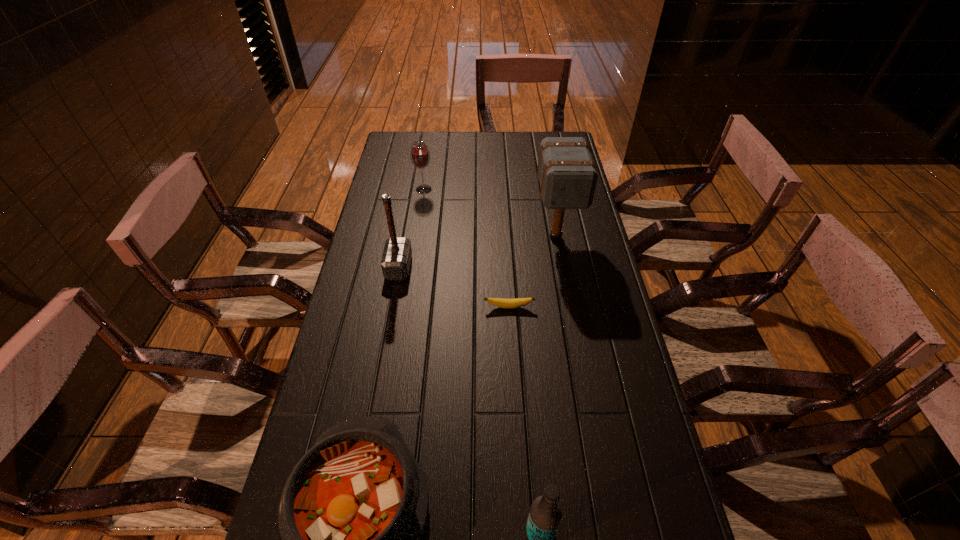
This screenshot has height=540, width=960. I want to click on mallet, so click(568, 176).

Identify the location of the tallest object. [568, 176].

Image resolution: width=960 pixels, height=540 pixels. In order to click on hammer in this screenshot , I will do `click(396, 259)`.

Where is `the farthest object`? This screenshot has width=960, height=540. the farthest object is located at coordinates (420, 157).

I want to click on wineglass, so click(420, 157).

Locate an element on the screen. the fourth farthest object is located at coordinates (499, 302).

You are a GUI agent. You are given a task and a screenshot of the screen. Output one action in this format:
    pyautogui.click(x=<x>, y=<y>)
    Task: Click on the shortest object
    The image size is (960, 540).
    Given the screenshot: What is the action you would take?
    pyautogui.click(x=499, y=302)

Locate an element on the screen. Image resolution: width=960 pixels, height=540 pixels. free spot located on the striking surface of the mallet is located at coordinates (569, 314).

Locate an element on the screen. The image size is (960, 540). blank space located 0.290m on the striking surface of the hammer is located at coordinates (501, 267).

What are the coordinates of `vacant region located 0.280m on the front of the wineglass` in the screenshot? It's located at (416, 244).